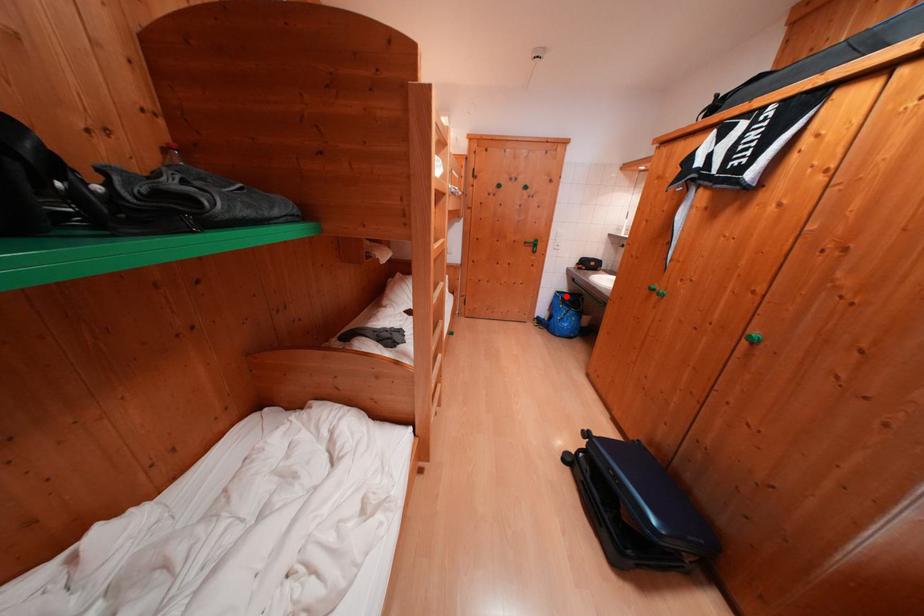
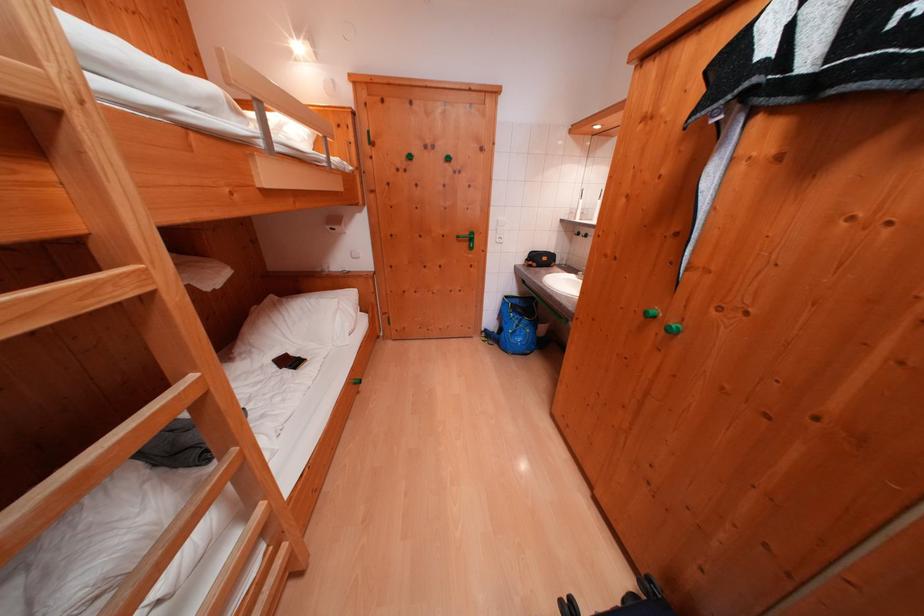
Question: I am providing you with two images of the same scene from different viewpoints. Image1 has a red point marked. In image2, the corresponding 3D location appears at what relative position? Reply with the corresponding letter.

Choices:
 (A) Closer
 (B) Farther

Answer: (B)